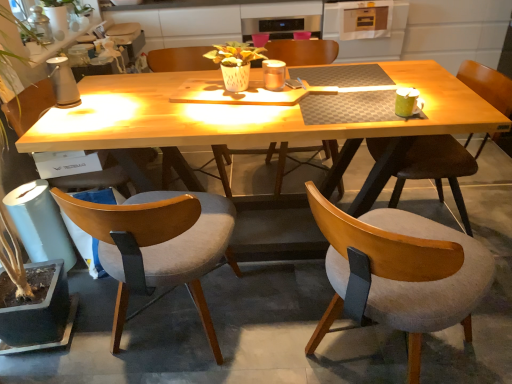
Question: From a real-world perspective, is light brown wood chair at lower left, which appears as the first chair when viewed from the left, located beneath green leafy plant at left?

Choices:
 (A) no
 (B) yes

Answer: (B)

Question: Is light brown wood chair at lower left, arranged as the fifth chair when viewed from the right, behind green leafy plant at left?

Choices:
 (A) no
 (B) yes

Answer: (B)

Question: Is light brown wood chair at lower left, which appears as the first chair when viewed from the left, to the right of green leafy plant at left from the viewer's perspective?

Choices:
 (A) no
 (B) yes

Answer: (B)

Question: Does light brown wood chair at lower left, which appears as the first chair when viewed from the left, have a lesser width compared to green leafy plant at left?

Choices:
 (A) yes
 (B) no

Answer: (A)

Question: Based on their positions, is wooden chair at center, the second chair in the right-to-left sequence, located to the left or right of metallic silver oven at upper center?

Choices:
 (A) left
 (B) right

Answer: (A)

Question: Considering the positions of wooden chair at center, the second chair in the right-to-left sequence, and metallic silver oven at upper center in the image, is wooden chair at center, the second chair in the right-to-left sequence, bigger or smaller than metallic silver oven at upper center?

Choices:
 (A) big
 (B) small

Answer: (B)

Question: Considering their positions, is wooden chair at center, acting as the 4th chair starting from the left, located in front of or behind metallic silver oven at upper center?

Choices:
 (A) front
 (B) behind

Answer: (A)

Question: Does point (375, 281) appear closer or farther from the camera than point (387, 33)?

Choices:
 (A) closer
 (B) farther

Answer: (A)

Question: From a real-world perspective, is wooden upholstered chair at right, placed as the fifth chair when sorted from left to right, positioned above or below metallic silver oven at upper center?

Choices:
 (A) below
 (B) above

Answer: (A)

Question: Is point (437, 193) closer or farther from the camera than point (375, 3)?

Choices:
 (A) closer
 (B) farther

Answer: (A)

Question: Based on their positions, is wooden upholstered chair at right, which appears as the 1th chair when viewed from the right, located to the left or right of metallic silver oven at upper center?

Choices:
 (A) right
 (B) left

Answer: (A)

Question: Is wooden upholstered chair at right, which appears as the 1th chair when viewed from the right, taller or shorter than metallic silver oven at upper center?

Choices:
 (A) tall
 (B) short

Answer: (A)

Question: Considering the relative positions of light gray fabric chair at lower left, the 4th chair positioned from the right, and wooden chair at center, arranged as the third chair when viewed from the left, in the image provided, is light gray fabric chair at lower left, the 4th chair positioned from the right, to the left or to the right of wooden chair at center, arranged as the third chair when viewed from the left,?

Choices:
 (A) right
 (B) left

Answer: (B)

Question: Is light gray fabric chair at lower left, the 4th chair positioned from the right, taller or shorter than wooden chair at center, which appears as the third chair when viewed from the right?

Choices:
 (A) tall
 (B) short

Answer: (B)